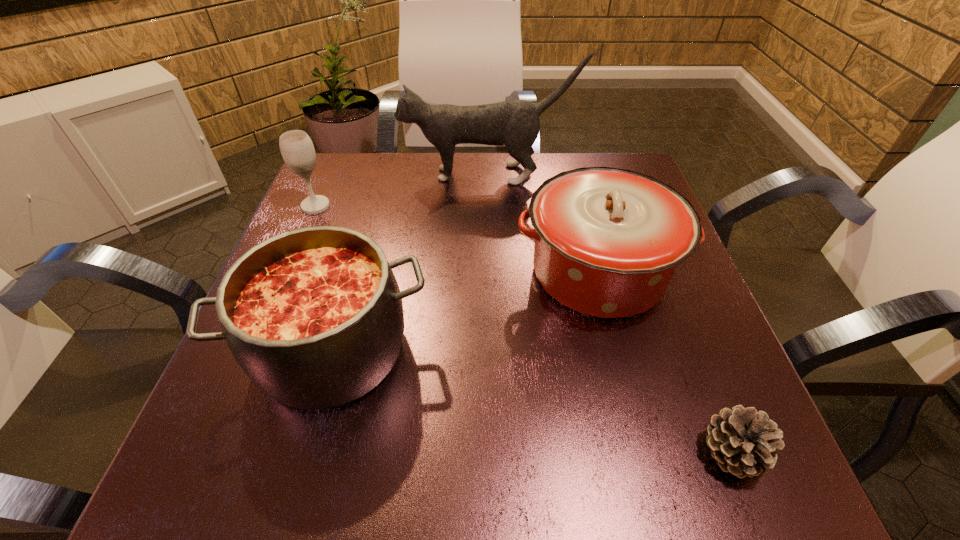
Where is `the tallest object`? Image resolution: width=960 pixels, height=540 pixels. the tallest object is located at coordinates (515, 124).

Locate an element on the screen. The height and width of the screenshot is (540, 960). the farthest object is located at coordinates (515, 124).

Where is `the right casserole`? the right casserole is located at coordinates (607, 241).

The height and width of the screenshot is (540, 960). Find the location of `wineglass`. wineglass is located at coordinates (297, 149).

Locate an element on the screen. Image resolution: width=960 pixels, height=540 pixels. the left casserole is located at coordinates (314, 316).

Where is `pinecone`? pinecone is located at coordinates (743, 441).

Find the location of a particular element. The width and height of the screenshot is (960, 540). the shortest object is located at coordinates (743, 441).

The width and height of the screenshot is (960, 540). Identify the location of vacant space located 0.150m at the face of the farthest object. [x=344, y=174].

The image size is (960, 540). I want to click on free space located 0.190m at the face of the farthest object, so click(x=327, y=174).

Where is `free spot located at the face of the farthest object`? This screenshot has height=540, width=960. free spot located at the face of the farthest object is located at coordinates (332, 174).